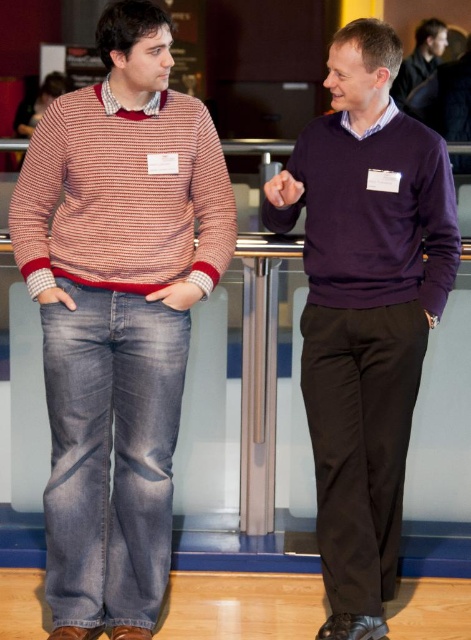
Question: Is purple matte sweater at center positioned behind matte purple sweater at upper right?

Choices:
 (A) no
 (B) yes

Answer: (A)

Question: Does matte red and white sweater at left have a greater width compared to purple matte sweater at center?

Choices:
 (A) yes
 (B) no

Answer: (A)

Question: Which object appears closest to the camera in this image?

Choices:
 (A) matte red and white sweater at left
 (B) purple matte sweater at center
 (C) matte purple sweater at upper right

Answer: (A)

Question: Does matte red and white sweater at left come in front of purple matte sweater at center?

Choices:
 (A) yes
 (B) no

Answer: (A)

Question: Estimate the real-world distances between objects in this image. Which object is closer to the matte purple sweater at upper right?

Choices:
 (A) matte red and white sweater at left
 (B) purple matte sweater at center

Answer: (B)

Question: Among these objects, which one is farthest from the camera?

Choices:
 (A) purple matte sweater at center
 (B) matte purple sweater at upper right
 (C) matte red and white sweater at left

Answer: (B)